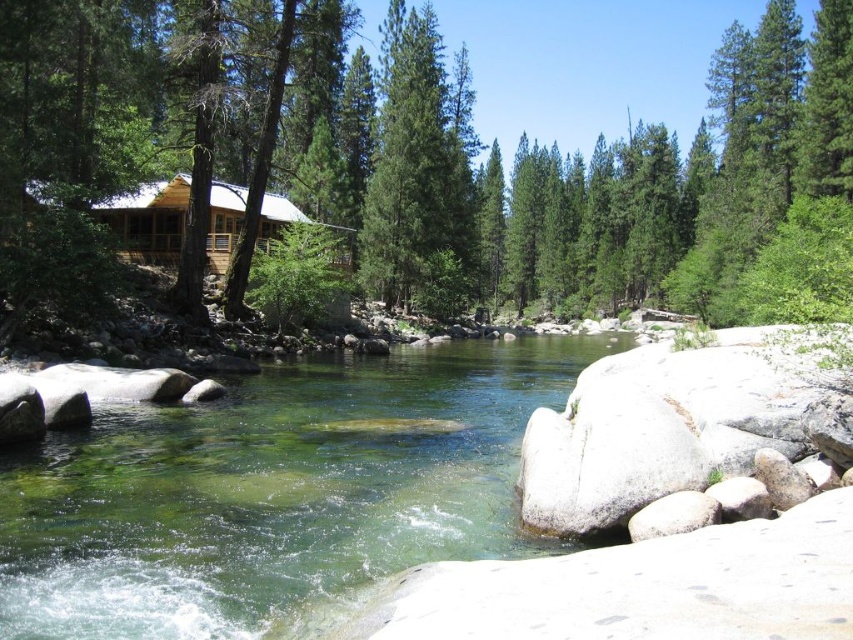
Question: Which object is positioned farthest from the green textured pine tree at center?

Choices:
 (A) clear glass water at center
 (B) green textured tree at center

Answer: (A)

Question: Does green textured tree at center have a smaller size compared to clear glass water at center?

Choices:
 (A) no
 (B) yes

Answer: (A)

Question: Observing the image, what is the correct spatial positioning of green textured tree at center in reference to green textured pine tree at center?

Choices:
 (A) above
 (B) below

Answer: (A)

Question: Does green textured tree at center have a lesser width compared to clear glass water at center?

Choices:
 (A) no
 (B) yes

Answer: (A)

Question: Estimate the real-world distances between objects in this image. Which object is closer to the green textured pine tree at center?

Choices:
 (A) green textured tree at center
 (B) clear glass water at center

Answer: (A)

Question: Which is farther from the green textured pine tree at center?

Choices:
 (A) clear glass water at center
 (B) green textured tree at center

Answer: (A)